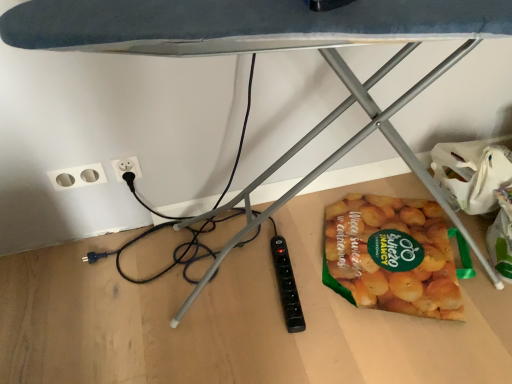
Question: Are translucent plastic bag of sliced potatoes at lower right and white plastic socket at lower left beside each other?

Choices:
 (A) yes
 (B) no

Answer: (B)

Question: Is translucent plastic bag of sliced potatoes at lower right facing towards white plastic socket at lower left?

Choices:
 (A) no
 (B) yes

Answer: (A)

Question: Is translucent plastic bag of sliced potatoes at lower right thinner than white plastic socket at lower left?

Choices:
 (A) no
 (B) yes

Answer: (A)

Question: Can white plastic socket at lower left be found inside translucent plastic bag of sliced potatoes at lower right?

Choices:
 (A) no
 (B) yes

Answer: (A)

Question: From the image's perspective, is translucent plastic bag of sliced potatoes at lower right on top of white plastic socket at lower left?

Choices:
 (A) no
 (B) yes

Answer: (A)

Question: Is point (79, 183) positioned closer to the camera than point (118, 170)?

Choices:
 (A) closer
 (B) farther

Answer: (A)

Question: From the image's perspective, is white plastic socket at lower left located above or below white plastic electric outlet at lower left?

Choices:
 (A) below
 (B) above

Answer: (A)

Question: From a real-world perspective, is white plastic socket at lower left above or below white plastic electric outlet at lower left?

Choices:
 (A) below
 (B) above

Answer: (A)

Question: Looking at the image, does white plastic socket at lower left seem bigger or smaller compared to white plastic electric outlet at lower left?

Choices:
 (A) big
 (B) small

Answer: (B)

Question: From a real-world perspective, is translucent plastic bag of sliced potatoes at lower right positioned above or below white plastic socket at lower left?

Choices:
 (A) above
 (B) below

Answer: (B)

Question: Looking at the image, does translucent plastic bag of sliced potatoes at lower right seem bigger or smaller compared to white plastic socket at lower left?

Choices:
 (A) small
 (B) big

Answer: (B)

Question: Looking at their shapes, would you say translucent plastic bag of sliced potatoes at lower right is wider or thinner than white plastic socket at lower left?

Choices:
 (A) wide
 (B) thin

Answer: (A)

Question: Is translucent plastic bag of sliced potatoes at lower right taller or shorter than white plastic socket at lower left?

Choices:
 (A) tall
 (B) short

Answer: (B)

Question: From the image's perspective, is white plastic electric outlet at lower left located above or below translucent plastic bag of sliced potatoes at lower right?

Choices:
 (A) below
 (B) above

Answer: (B)

Question: Is white plastic electric outlet at lower left to the left or to the right of translucent plastic bag of sliced potatoes at lower right in the image?

Choices:
 (A) right
 (B) left

Answer: (B)